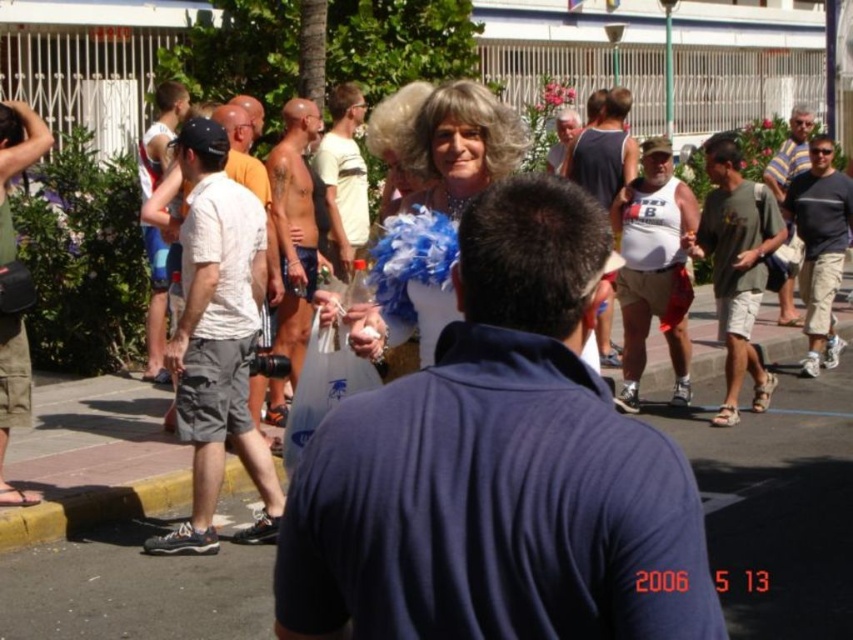
Question: Can you confirm if dark green t-shirt at right is positioned to the right of white tank top at center?

Choices:
 (A) yes
 (B) no

Answer: (A)

Question: Does white cotton shirt at left appear over matte white shirt at center?

Choices:
 (A) no
 (B) yes

Answer: (A)

Question: Among these objects, which one is farthest from the camera?

Choices:
 (A) dark gray cotton shirt at right
 (B) matte white shirt at center
 (C) shiny metallic shorts at center

Answer: (B)

Question: Considering the real-world distances, which object is farthest from the matte blue wig at center?

Choices:
 (A) dark green t-shirt at right
 (B) striped cotton shirt at right
 (C) white tank top at center

Answer: (B)

Question: Is white cotton shirt at left closer to the viewer compared to dark gray cotton shirt at right?

Choices:
 (A) yes
 (B) no

Answer: (A)

Question: Which is farther from the striped cotton shirt at right?

Choices:
 (A) light yellow t-shirt at center
 (B) white tank top at center
 (C) matte white wig at center
 (D) matte blue wig at center

Answer: (D)